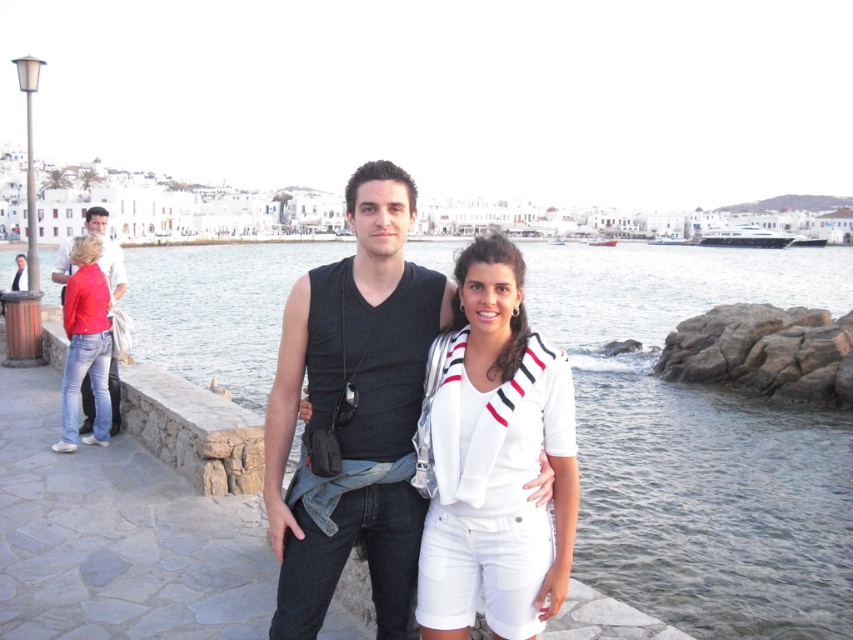
Question: Can you confirm if white cotton shirt at center is positioned to the left of denim jeans at left?

Choices:
 (A) no
 (B) yes

Answer: (A)

Question: Which object is the farthest from the white cotton shirt at center?

Choices:
 (A) clear water at center
 (B) black sleeveless shirt at center

Answer: (A)

Question: Among these points, which one is nearest to the camera?

Choices:
 (A) (781, 577)
 (B) (291, 429)
 (C) (59, 268)

Answer: (B)

Question: Can you confirm if clear water at center is smaller than white cotton shirt at center?

Choices:
 (A) yes
 (B) no

Answer: (B)

Question: In this image, where is white cotton shirt at center located relative to denim jeans at left?

Choices:
 (A) left
 (B) right

Answer: (B)

Question: Among these points, which one is nearest to the camera?

Choices:
 (A) (532, 433)
 (B) (309, 493)
 (C) (85, 376)

Answer: (A)